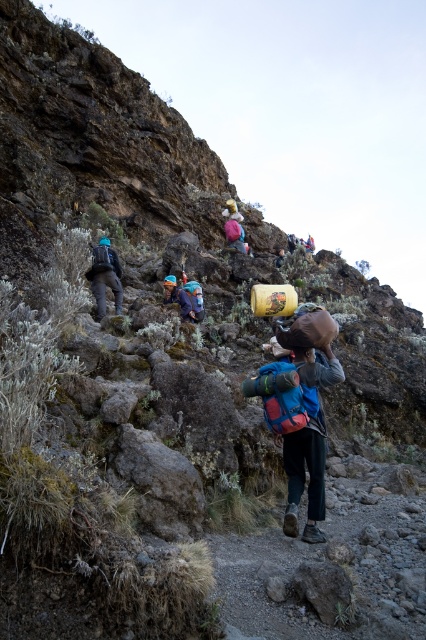
Question: Can you confirm if matte black backpack at left is positioned to the right of matte pink backpack at center?

Choices:
 (A) yes
 (B) no

Answer: (B)

Question: Which object is closer to the camera taking this photo?

Choices:
 (A) matte pink backpack at center
 (B) brushed metal backpack at center

Answer: (B)

Question: Based on their relative distances, which object is nearer to the matte pink backpack at center?

Choices:
 (A) matte black backpack at left
 (B) brushed metal backpack at center

Answer: (B)

Question: Is matte pink backpack at center wider than brushed metal backpack at center?

Choices:
 (A) yes
 (B) no

Answer: (A)

Question: Which of these objects is positioned closest to the matte pink backpack at center?

Choices:
 (A) matte black backpack at left
 (B) brushed metal backpack at center

Answer: (B)

Question: Does matte pink backpack at center lie behind brushed metal backpack at center?

Choices:
 (A) no
 (B) yes

Answer: (B)